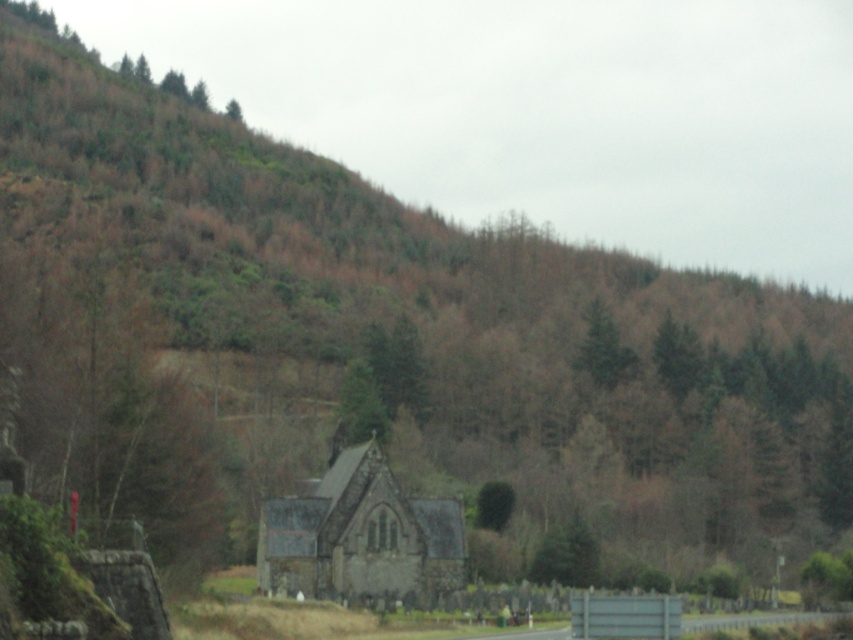
Consider the image. You are standing in the rural landscape looking at the hillside with the church in the foreground. There are two points marked on the image. Which point is closer to you, point (451, 515) or point (573, 364)?

Point (451, 515) is closer to the viewer than point (573, 364).

You are a drone operator tasked with capturing aerial footage of the stone church at center. The drone must maintain a minimum altitude of 10 meters above the church roof to avoid detection. Given the church roof height is 15 meters, what is the minimum safe altitude the drone should fly at?

The minimum safe altitude the drone should fly at is 25 meters, as it needs to stay 10 meters above the church roof, which is 15 meters tall. 15 meters plus 10 meters equals 25 meters.

You are a photographer planning to capture a wide shot of the stone church at center and the green textured tree at upper center. Based on their sizes in the image, which one would require you to stand closer to ensure both fit in the frame?

The stone church at center might be wider than green textured tree at upper center, so you might need to stand closer to the stone church at center to ensure both fit in the frame.